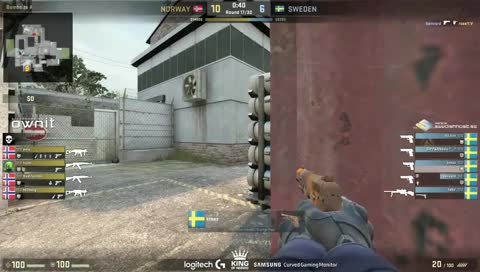
This screenshot has width=480, height=272. What are the coordinates of `rack` in the screenshot? It's located at (247, 149).